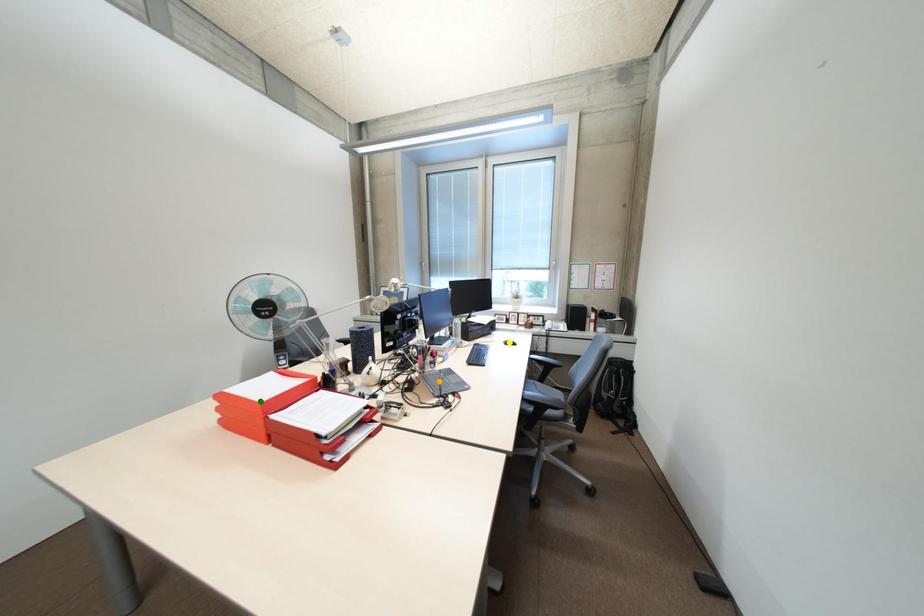
Order these from nearest to farthest:
A) orange point
B) yellow point
C) green point

green point < orange point < yellow point